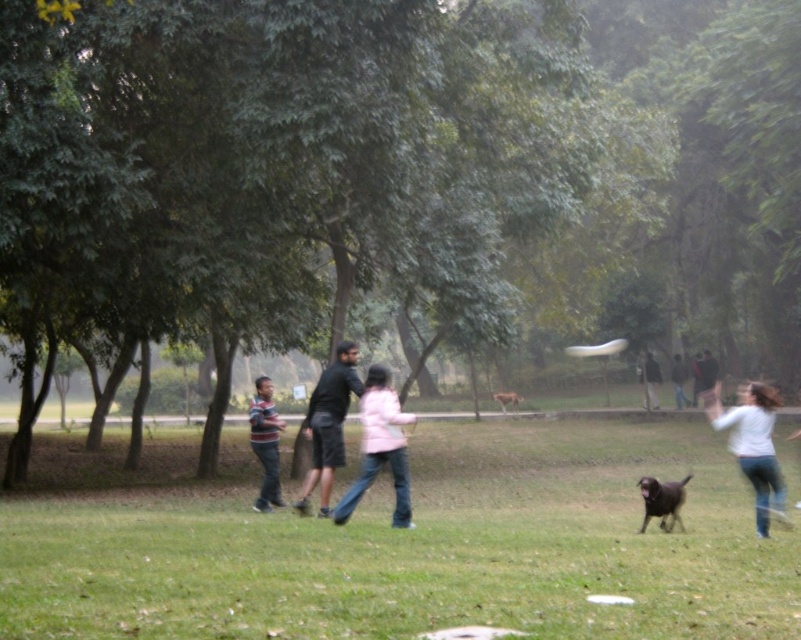
You are standing in the park and see the striped cotton shirt at center and the white plastic frisbee at center. Which object is closer to the left edge of the image?

The striped cotton shirt at center is closer to the left edge of the image because it is positioned to the left of the white plastic frisbee at center.

You are standing in the park and see the green grass at center and the pink matte jacket at center. Which object is located to the right of the other?

The green grass at center is positioned on the right side of pink matte jacket at center.